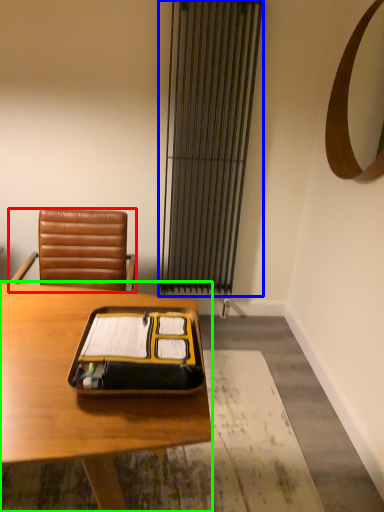
Question: Based on their relative distances, which object is farther from chair (highlighted by a red box)? Choose from curtain (highlighted by a blue box) and desk (highlighted by a green box).

Choices:
 (A) curtain
 (B) desk

Answer: (A)